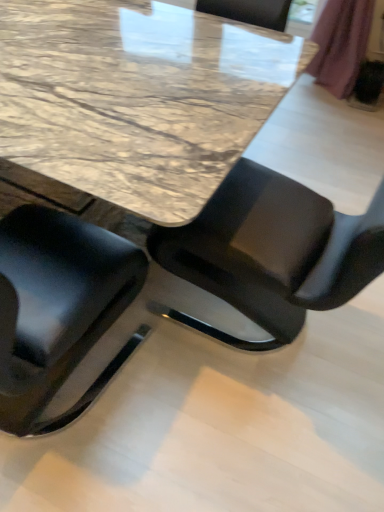
Where is `marble table at center`? The height and width of the screenshot is (512, 384). marble table at center is located at coordinates (137, 97).

The height and width of the screenshot is (512, 384). What do you see at coordinates (137, 97) in the screenshot?
I see `marble table at center` at bounding box center [137, 97].

Identify the location of marble table at center. This screenshot has width=384, height=512. (137, 97).